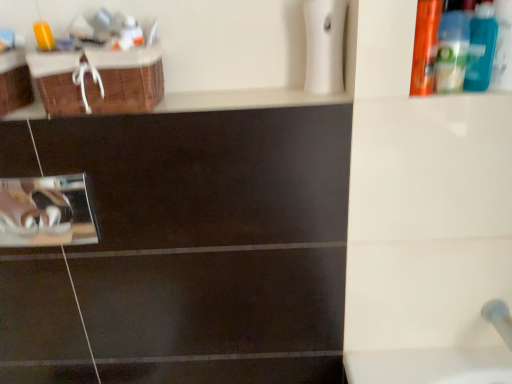
In order to face brown woven basket at upper left, should I rotate leftwards or rightwards?

To face it directly, rotate left by 19.788 degrees.

This screenshot has width=512, height=384. Describe the element at coordinates (126, 90) in the screenshot. I see `brown woven basket at upper left` at that location.

In order to face orange plastic bottle at upper right, which is the third mouthwash in right-to-left order, should I rotate leftwards or rightwards?

A 21.848 degree turn to the right will do.

Where is `blue plastic bottle at upper right, the 2th mouthwash when ordered from right to left`? blue plastic bottle at upper right, the 2th mouthwash when ordered from right to left is located at coordinates pyautogui.click(x=452, y=52).

Identify the location of brown woven basket at upper left. Image resolution: width=512 pixels, height=384 pixels. [126, 90].

From the picture: Is white glossy pipe at lower right looking in the opposite direction of blue plastic bottle at upper right, arranged as the first mouthwash when viewed from the right?

No, white glossy pipe at lower right is not facing away from blue plastic bottle at upper right, arranged as the first mouthwash when viewed from the right.

Considering the relative sizes of white glossy pipe at lower right and blue plastic bottle at upper right, arranged as the first mouthwash when viewed from the right, in the image provided, is white glossy pipe at lower right taller than blue plastic bottle at upper right, arranged as the first mouthwash when viewed from the right,?

In fact, white glossy pipe at lower right may be shorter than blue plastic bottle at upper right, arranged as the first mouthwash when viewed from the right.

From the image's perspective, which one is positioned higher, white glossy pipe at lower right or blue plastic bottle at upper right, arranged as the first mouthwash when viewed from the right?

blue plastic bottle at upper right, arranged as the first mouthwash when viewed from the right, appears higher in the image.

Is blue plastic bottle at upper right, arranged as the first mouthwash when viewed from the right, oriented away from brown woven basket at upper left?

That's not correct — blue plastic bottle at upper right, arranged as the first mouthwash when viewed from the right, is not looking away from brown woven basket at upper left.

From the image's perspective, is blue plastic bottle at upper right, arranged as the first mouthwash when viewed from the right, on brown woven basket at upper left?

Yes.

Is brown woven basket at upper left looking in the opposite direction of translucent plastic mouthwash at upper left, which ranks as the first mouthwash in left-to-right order?

No, brown woven basket at upper left is not facing the opposite direction of translucent plastic mouthwash at upper left, which ranks as the first mouthwash in left-to-right order.

Based on the photo, from a real-world perspective, which object rests below the other?

brown woven basket at upper left is physically lower.

Could you measure the distance between brown woven basket at upper left and translucent plastic mouthwash at upper left, positioned as the fourth mouthwash in right-to-left order?

brown woven basket at upper left and translucent plastic mouthwash at upper left, positioned as the fourth mouthwash in right-to-left order, are 10.36 centimeters apart.

What are the coordinates of `the 4th mouthwash located above the brown woven basket at upper left (from a real-world perspective)` in the screenshot? It's located at (130, 34).

Which of these two, blue plastic bottle at upper right, the 2th mouthwash when ordered from right to left, or orange plastic bottle at upper right, which is the third mouthwash in right-to-left order, is smaller?

Smaller between the two is orange plastic bottle at upper right, which is the third mouthwash in right-to-left order.

Which object is positioned more to the right, blue plastic bottle at upper right, the 2th mouthwash when ordered from right to left, or orange plastic bottle at upper right, the second mouthwash when ordered from left to right?

Positioned to the right is blue plastic bottle at upper right, the 2th mouthwash when ordered from right to left.

From the image's perspective, which is below, blue plastic bottle at upper right, the 2th mouthwash when ordered from right to left, or orange plastic bottle at upper right, the second mouthwash when ordered from left to right?

orange plastic bottle at upper right, the second mouthwash when ordered from left to right, is shown below in the image.

Are blue plastic bottle at upper right, the fourth mouthwash in the left-to-right sequence, and blue plastic bottle at upper right, the third mouthwash in the left-to-right sequence, beside each other?

Yes, blue plastic bottle at upper right, the fourth mouthwash in the left-to-right sequence, is beside blue plastic bottle at upper right, the third mouthwash in the left-to-right sequence.

Is blue plastic bottle at upper right, arranged as the first mouthwash when viewed from the right, looking in the opposite direction of blue plastic bottle at upper right, the third mouthwash in the left-to-right sequence?

No, blue plastic bottle at upper right, arranged as the first mouthwash when viewed from the right,'s orientation is not away from blue plastic bottle at upper right, the third mouthwash in the left-to-right sequence.

Considering the sizes of objects blue plastic bottle at upper right, the fourth mouthwash in the left-to-right sequence, and blue plastic bottle at upper right, the third mouthwash in the left-to-right sequence, in the image provided, who is smaller, blue plastic bottle at upper right, the fourth mouthwash in the left-to-right sequence, or blue plastic bottle at upper right, the third mouthwash in the left-to-right sequence,?

blue plastic bottle at upper right, the fourth mouthwash in the left-to-right sequence, is smaller.

From a real-world perspective, which object stands above the other?

blue plastic bottle at upper right, the fourth mouthwash in the left-to-right sequence, is physically above.

Considering the relative sizes of blue plastic bottle at upper right, arranged as the first mouthwash when viewed from the right, and white glossy pipe at lower right in the image provided, is blue plastic bottle at upper right, arranged as the first mouthwash when viewed from the right, thinner than white glossy pipe at lower right?

Yes, blue plastic bottle at upper right, arranged as the first mouthwash when viewed from the right, is thinner than white glossy pipe at lower right.

From the image's perspective, does blue plastic bottle at upper right, the fourth mouthwash in the left-to-right sequence, appear higher than white glossy pipe at lower right?

Yes, from the image's perspective, blue plastic bottle at upper right, the fourth mouthwash in the left-to-right sequence, is on top of white glossy pipe at lower right.

Choose the correct answer: Is blue plastic bottle at upper right, arranged as the first mouthwash when viewed from the right, inside white glossy pipe at lower right or outside it?

blue plastic bottle at upper right, arranged as the first mouthwash when viewed from the right, is spatially situated outside white glossy pipe at lower right.

Is translucent plastic mouthwash at upper left, positioned as the fourth mouthwash in right-to-left order, at the left side of white glossy pipe at lower right?

Indeed, translucent plastic mouthwash at upper left, positioned as the fourth mouthwash in right-to-left order, is positioned on the left side of white glossy pipe at lower right.

Is translucent plastic mouthwash at upper left, positioned as the fourth mouthwash in right-to-left order, not near white glossy pipe at lower right?

Yes.

Which of these two, translucent plastic mouthwash at upper left, which ranks as the first mouthwash in left-to-right order, or white glossy pipe at lower right, stands shorter?

Standing shorter between the two is white glossy pipe at lower right.

I want to click on plumbing fixture that is on the right side of blue plastic bottle at upper right, arranged as the first mouthwash when viewed from the right, so click(x=499, y=319).

From a real-world perspective, starting from the brown woven basket at upper left, which mouthwash is the 3rd one vertically above it? Please provide its 2D coordinates.

[(481, 47)]

From the picture: Estimate the real-world distances between objects in this image. Which object is closer to blue plastic bottle at upper right, the fourth mouthwash in the left-to-right sequence, white glossy pipe at lower right or brown woven basket at upper left?

white glossy pipe at lower right is positioned closer to the anchor blue plastic bottle at upper right, the fourth mouthwash in the left-to-right sequence.

When comparing their distances from white glossy pipe at lower right, does translucent plastic mouthwash at upper left, which ranks as the first mouthwash in left-to-right order, or brown woven basket at upper left seem closer?

brown woven basket at upper left is closer to white glossy pipe at lower right.

Based on their spatial positions, is brown woven basket at upper left or white glossy pipe at lower right further from translucent plastic mouthwash at upper left, which ranks as the first mouthwash in left-to-right order?

Based on the image, white glossy pipe at lower right appears to be further to translucent plastic mouthwash at upper left, which ranks as the first mouthwash in left-to-right order.

When comparing their distances from blue plastic bottle at upper right, the fourth mouthwash in the left-to-right sequence, does orange plastic bottle at upper right, which is the third mouthwash in right-to-left order, or white glossy pipe at lower right seem further?

Based on the image, white glossy pipe at lower right appears to be further to blue plastic bottle at upper right, the fourth mouthwash in the left-to-right sequence.

When comparing their distances from brown woven basket at upper left, does blue plastic bottle at upper right, the 2th mouthwash when ordered from right to left, or orange plastic bottle at upper right, which is the third mouthwash in right-to-left order, seem closer?

Based on the image, orange plastic bottle at upper right, which is the third mouthwash in right-to-left order, appears to be nearer to brown woven basket at upper left.

Considering their positions, is orange plastic bottle at upper right, the second mouthwash when ordered from left to right, positioned closer to blue plastic bottle at upper right, the third mouthwash in the left-to-right sequence, than brown woven basket at upper left?

The object closer to blue plastic bottle at upper right, the third mouthwash in the left-to-right sequence, is orange plastic bottle at upper right, the second mouthwash when ordered from left to right.

Based on their spatial positions, is brown woven basket at upper left or blue plastic bottle at upper right, arranged as the first mouthwash when viewed from the right, closer to white glossy pipe at lower right?

Based on the image, blue plastic bottle at upper right, arranged as the first mouthwash when viewed from the right, appears to be nearer to white glossy pipe at lower right.

From the image, which object appears to be farther from blue plastic bottle at upper right, the fourth mouthwash in the left-to-right sequence, blue plastic bottle at upper right, the 2th mouthwash when ordered from right to left, or white glossy pipe at lower right?

white glossy pipe at lower right lies further to blue plastic bottle at upper right, the fourth mouthwash in the left-to-right sequence, than the other object.

You are a GUI agent. You are given a task and a screenshot of the screen. Output one action in this format:
    pyautogui.click(x=<x>, y=<y>)
    Task: Click on the mouthwash between blue plastic bottle at upper right, the 2th mouthwash when ordered from right to left, and white glossy pipe at lower right in the up-down direction
    
    Given the screenshot: What is the action you would take?
    pyautogui.click(x=425, y=46)

Where is `mouthwash situated between brown woven basket at upper left and orange plastic bottle at upper right, the second mouthwash when ordered from left to right, from left to right`? This screenshot has height=384, width=512. mouthwash situated between brown woven basket at upper left and orange plastic bottle at upper right, the second mouthwash when ordered from left to right, from left to right is located at coordinates (130, 34).

Where is `mouthwash between orange plastic bottle at upper right, which is the third mouthwash in right-to-left order, and blue plastic bottle at upper right, arranged as the first mouthwash when viewed from the right, in the horizontal direction`? mouthwash between orange plastic bottle at upper right, which is the third mouthwash in right-to-left order, and blue plastic bottle at upper right, arranged as the first mouthwash when viewed from the right, in the horizontal direction is located at coordinates (452, 52).

At what (x,y) coordinates should I click in order to perform the action: click on mouthwash situated between translucent plastic mouthwash at upper left, which ranks as the first mouthwash in left-to-right order, and blue plastic bottle at upper right, the third mouthwash in the left-to-right sequence, from left to right. Please return your answer as a coordinate pair (x, y). The height and width of the screenshot is (384, 512). Looking at the image, I should click on (425, 46).